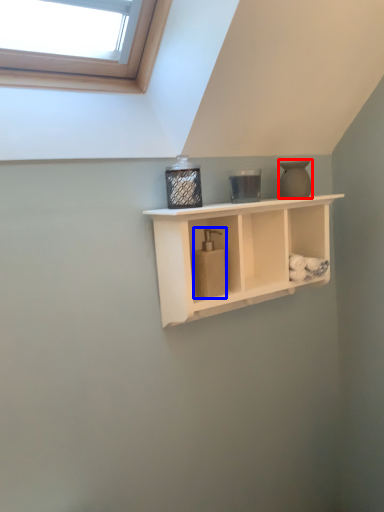
Question: Which of the following is the farthest to the observer, vase (highlighted by a red box) or soap dispenser (highlighted by a blue box)?

Choices:
 (A) vase
 (B) soap dispenser

Answer: (A)